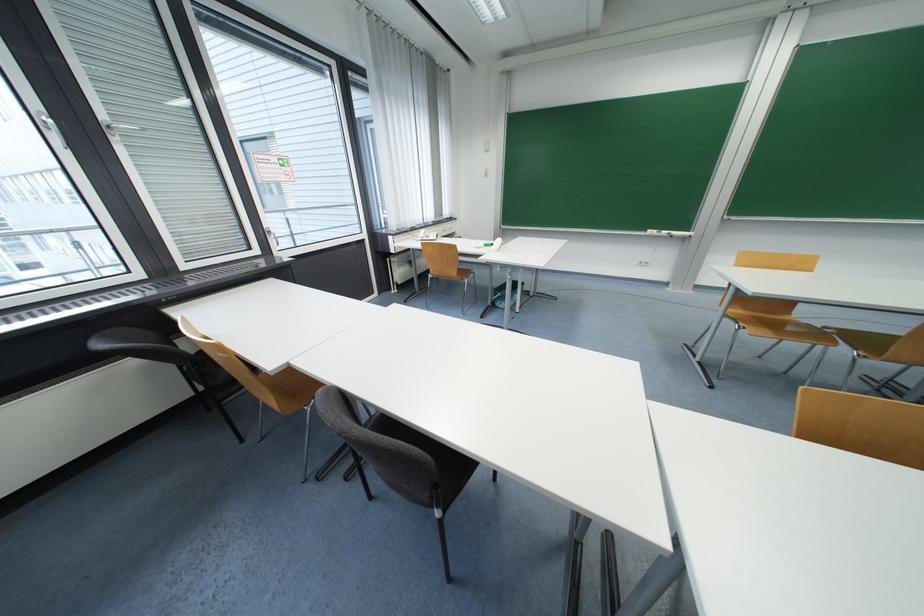
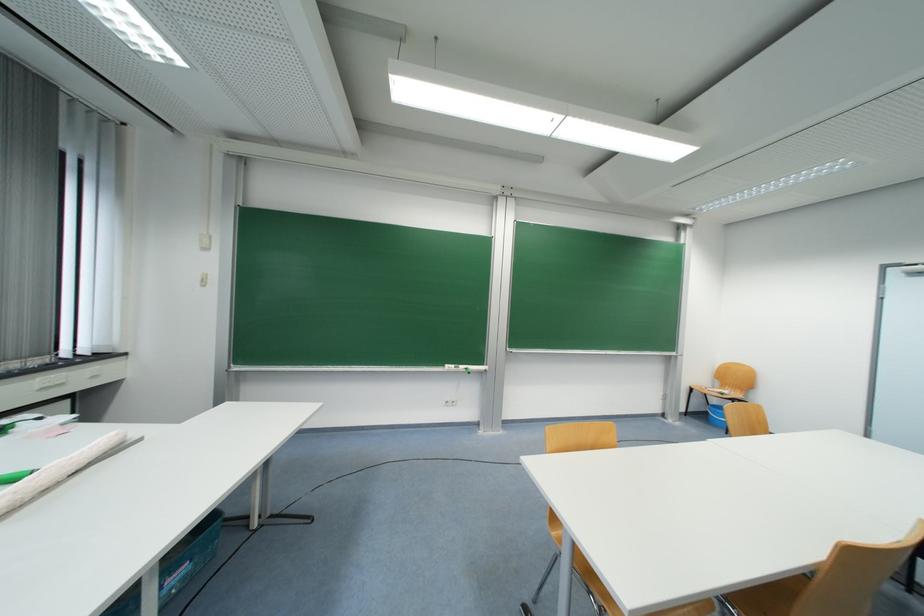
Question: I am providing you with two images of the same scene from different viewpoints. Which of the following objects are not visible in image2?

Choices:
 (A) white light switch
 (B) wooden chair sitting surface
 (C) white paper roll
 (D) none of these

Answer: (D)